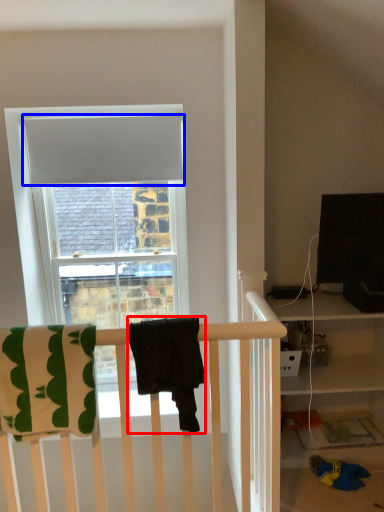
Question: Which object is further to the camera taking this photo, beach towel (highlighted by a red box) or curtain (highlighted by a blue box)?

Choices:
 (A) beach towel
 (B) curtain

Answer: (B)